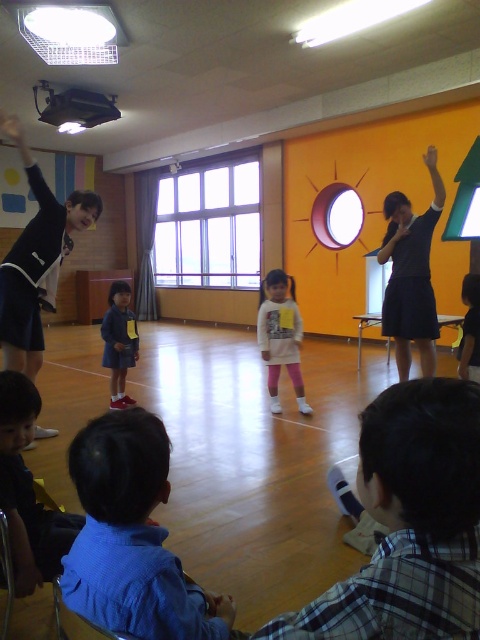
Question: Is matte black projector at upper left closer to camera compared to smooth skin hand at upper right?

Choices:
 (A) yes
 (B) no

Answer: (A)

Question: Which object is the farthest from the smooth skin hand at upper right?

Choices:
 (A) dark blue uniform at upper left
 (B) dark blue skirt at right
 (C) blue fabric shirt at lower left

Answer: (C)

Question: Which object is farther from the camera taking this photo?

Choices:
 (A) blue cotton shirt at lower left
 (B) dark blue skirt at right
 (C) blue fabric shirt at lower left
 (D) smooth black shirt at center

Answer: (B)

Question: Observing the image, what is the correct spatial positioning of dark blue uniform at upper left in reference to matte black projector at upper left?

Choices:
 (A) left
 (B) right

Answer: (A)

Question: Is white matte sweater at center above smooth skin hand at upper right?

Choices:
 (A) no
 (B) yes

Answer: (A)

Question: Which object is farther from the camera taking this photo?

Choices:
 (A) matte black projector at upper left
 (B) blue cotton shirt at lower left

Answer: (A)